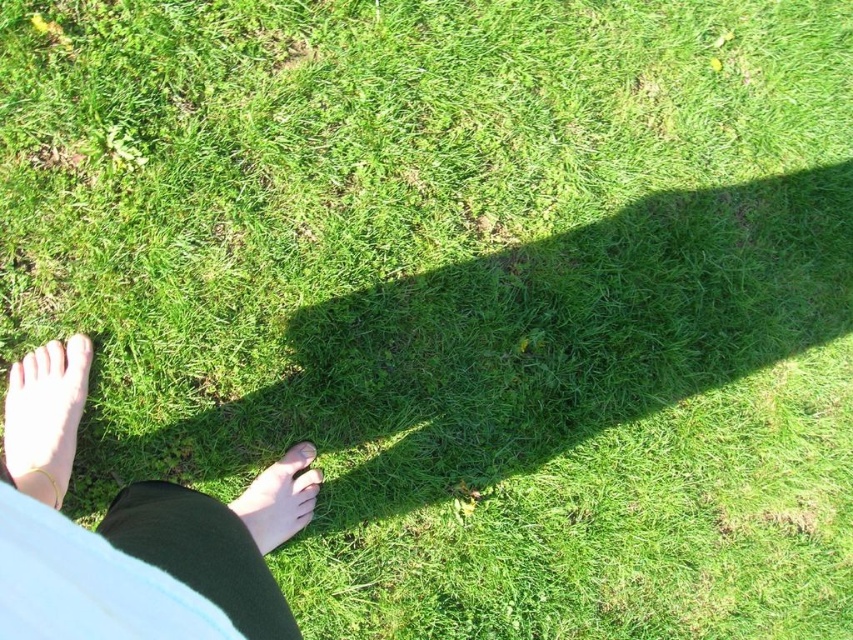
Which is in front, point (62, 483) or point (73, 337)?

Positioned in front is point (62, 483).

Is skinny barefoot feet at lower left taller than gold metallic bracelet at lower left?

Indeed, skinny barefoot feet at lower left has a greater height compared to gold metallic bracelet at lower left.

Does point (32, 486) come behind point (76, 426)?

That is False.

At what (x,y) coordinates should I click in order to perform the action: click on skinny barefoot feet at lower left. Please return your answer as a coordinate pair (x, y). Looking at the image, I should click on (131, 532).

Can you confirm if skinny barefoot feet at lower left is positioned above smooth skin foot at lower center?

Yes.

Is skinny barefoot feet at lower left below smooth skin foot at lower center?

No, skinny barefoot feet at lower left is not below smooth skin foot at lower center.

Find the location of a particular element. This screenshot has width=853, height=640. skinny barefoot feet at lower left is located at coordinates (131, 532).

Does gold metallic bracelet at lower left have a larger size compared to smooth skin foot at lower center?

Yes, gold metallic bracelet at lower left is bigger than smooth skin foot at lower center.

Is gold metallic bracelet at lower left wider than smooth skin foot at lower center?

In fact, gold metallic bracelet at lower left might be narrower than smooth skin foot at lower center.

This screenshot has width=853, height=640. I want to click on gold metallic bracelet at lower left, so click(45, 417).